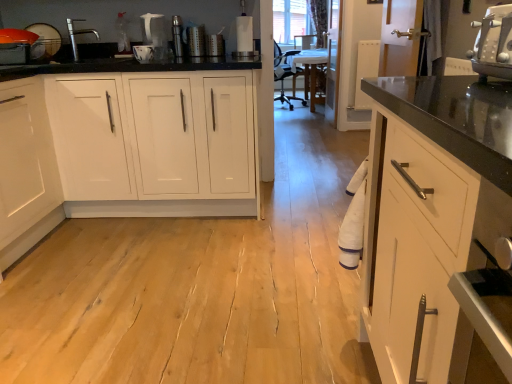
Question: Is metallic silver grater at upper center, which is the 1th appliance from right to left, wider or thinner than white plastic toaster at upper right?

Choices:
 (A) wide
 (B) thin

Answer: (B)

Question: Considering the positions of metallic silver grater at upper center, which is the 1th appliance from right to left, and white plastic toaster at upper right in the image, is metallic silver grater at upper center, which is the 1th appliance from right to left, bigger or smaller than white plastic toaster at upper right?

Choices:
 (A) small
 (B) big

Answer: (A)

Question: Estimate the real-world distances between objects in this image. Which object is closer to the white glossy cabinet at left?

Choices:
 (A) white plastic toaster at upper right
 (B) matte black sink at left, which is counted as the 3th appliance, starting from the right
 (C) metallic silver grater at upper center, which is the third appliance from left to right
 (D) metallic cylindrical at center, the second appliance positioned from the left
 (E) satin nickel faucet at upper left

Answer: (E)

Question: Which object is the farthest from the metallic silver grater at upper center, which is the third appliance from left to right?

Choices:
 (A) satin nickel faucet at upper left
 (B) metallic cylindrical at center, the second appliance positioned from the left
 (C) matte black sink at left, the first appliance viewed from the left
 (D) white plastic toaster at upper right
 (E) white glossy cabinet at left

Answer: (D)